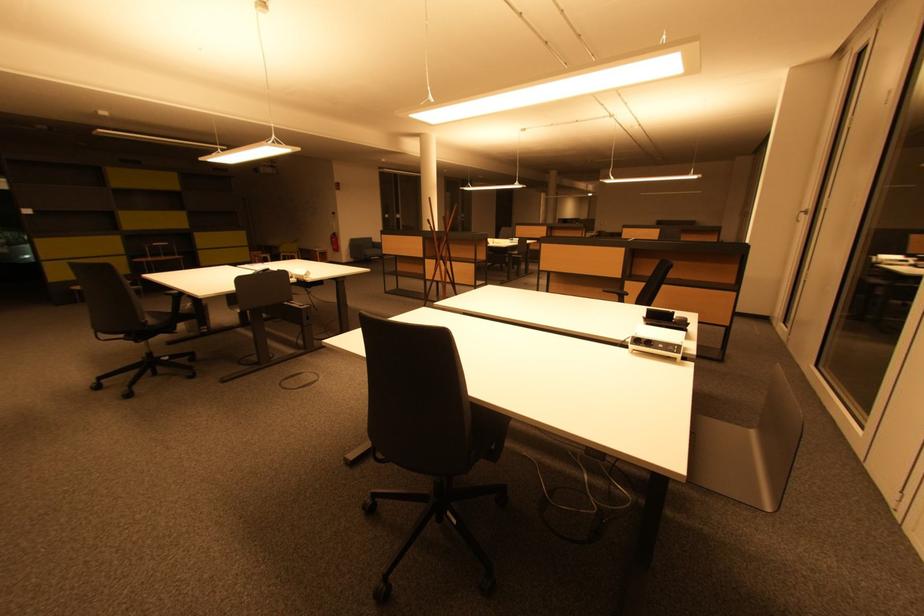
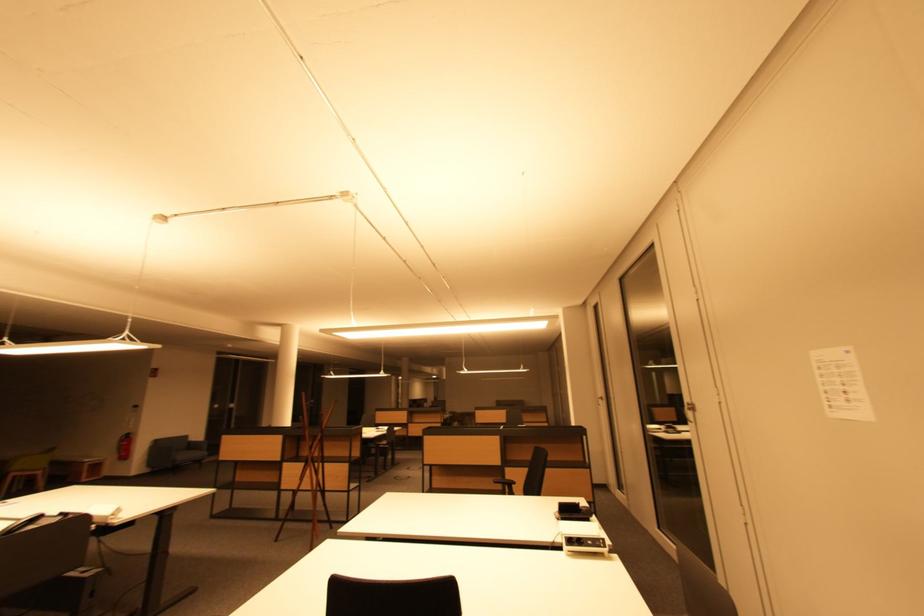
In the second image, find the point that corresponds to [341,251] in the first image.

(128, 458)